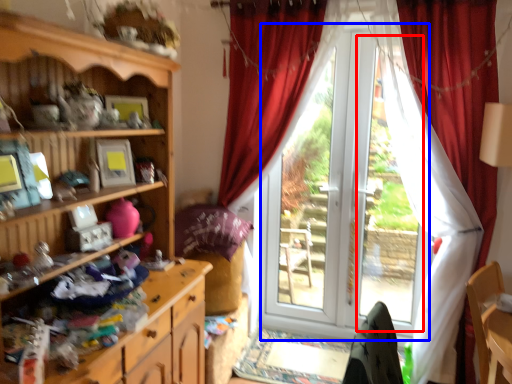
Question: Which object is closer to the camera taking this photo, bay window (highlighted by a red box) or screen door (highlighted by a blue box)?

Choices:
 (A) bay window
 (B) screen door

Answer: (B)